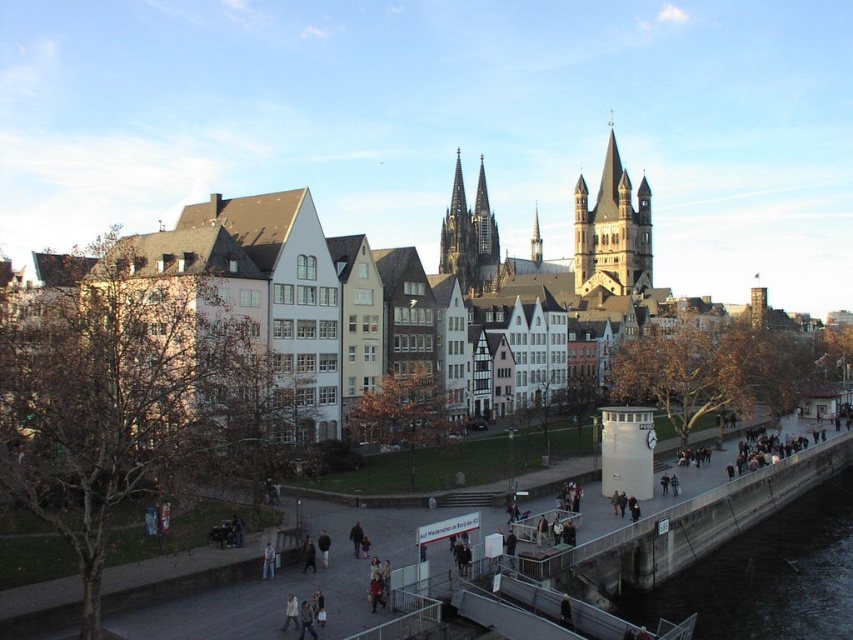
You are a tourist standing on the walkway and want to take a photo that includes both the dark gray concrete river at lower right and the golden stone tower at center. The camera you have can only capture objects within 120 meters of each other. Will both objects fit in the same frame?

The dark gray concrete river at lower right and the golden stone tower at center are 117.73 meters apart. Since the distance between them is less than 120 meters, both objects will fit in the same frame.

You are an architect visiting this area and want to compare the sizes of the two notable structures in the scene. Which one is larger between the white stone buildings at center and the golden stone tower at center?

The white stone buildings at center is bigger than the golden stone tower at center.